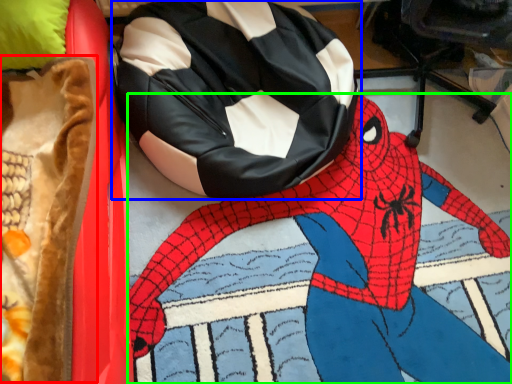
Question: Which object is the closest to the blanket (highlighted by a red box)? Choose among these: bean bag chair (highlighted by a blue box) or person (highlighted by a green box).

Choices:
 (A) bean bag chair
 (B) person

Answer: (A)